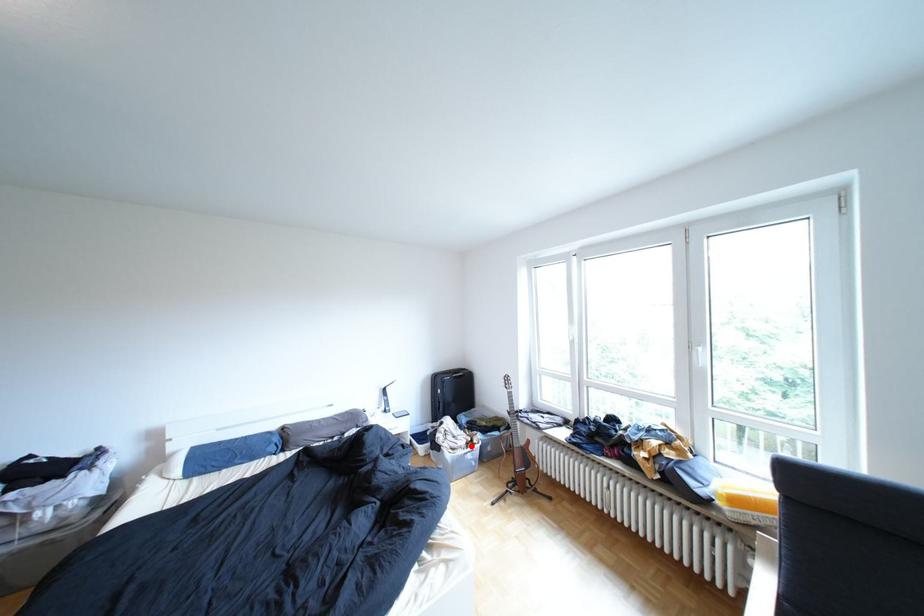
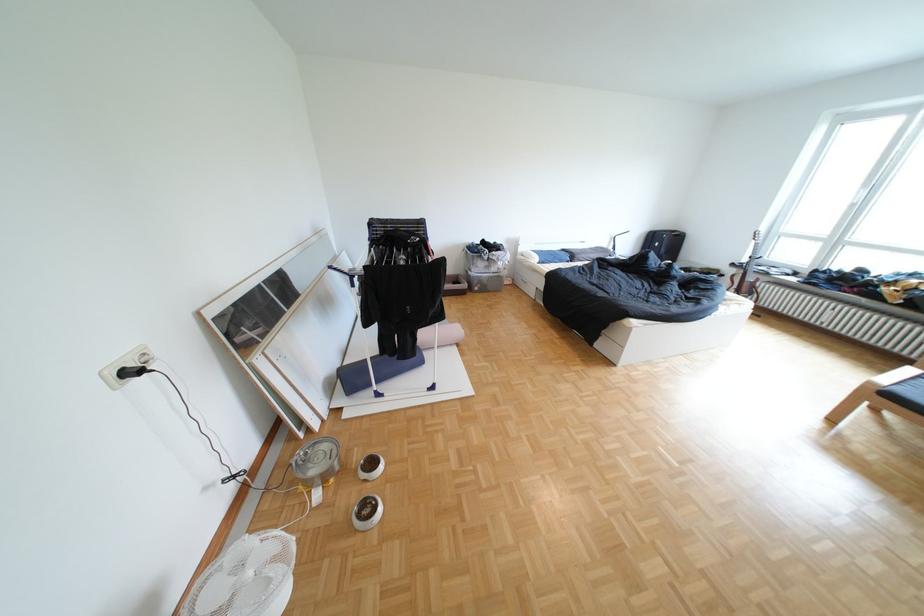
Question: I am providing you with two images of the same scene from different viewpoints. A red point is marked on the first image. Is the red point's position out of view in image 2?

Choices:
 (A) Yes
 (B) No

Answer: (A)